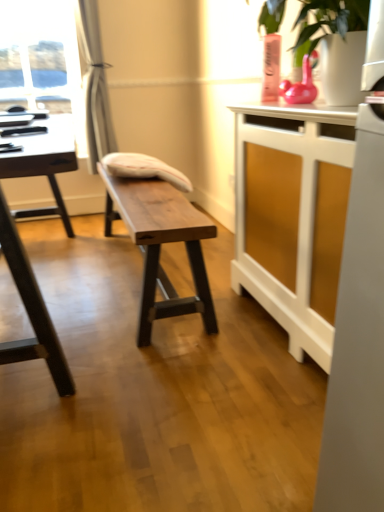
Where is `vacant area to the left of white wood cabinet at right, the 1th table positioned from the right`? vacant area to the left of white wood cabinet at right, the 1th table positioned from the right is located at coordinates (189, 351).